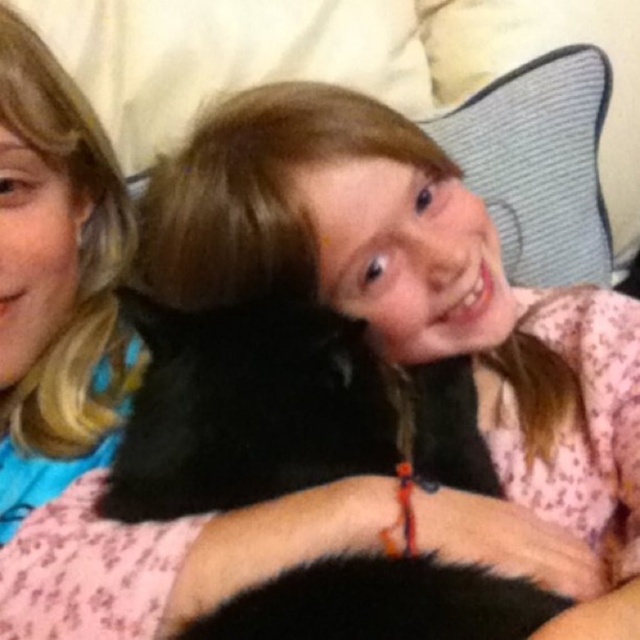
Question: Can you confirm if black fluffy cat at center is wider than textured blue pillow at upper center?

Choices:
 (A) yes
 (B) no

Answer: (A)

Question: Observing the image, what is the correct spatial positioning of black fluffy cat at center in reference to textured blue pillow at upper center?

Choices:
 (A) above
 (B) below

Answer: (B)

Question: Which point is closer to the camera?

Choices:
 (A) textured blue pillow at upper center
 (B) black fluffy cat at center

Answer: (B)

Question: Among these objects, which one is farthest from the camera?

Choices:
 (A) textured blue pillow at upper center
 (B) black fluffy cat at center

Answer: (A)

Question: Can you confirm if black fluffy cat at center is positioned below textured blue pillow at upper center?

Choices:
 (A) yes
 (B) no

Answer: (A)